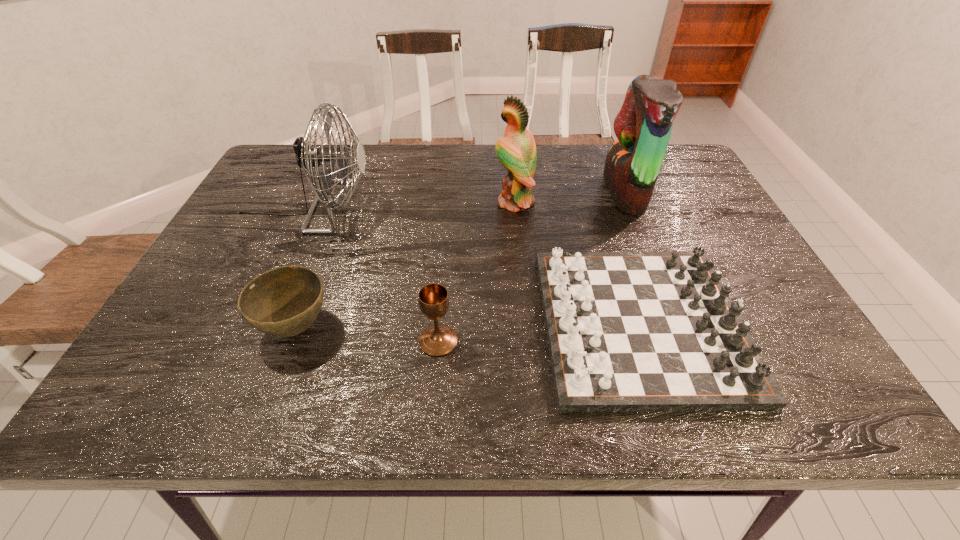
You are a GUI agent. You are given a task and a screenshot of the screen. Output one action in this format:
    pyautogui.click(x=<x>, y=<y>)
    Task: Click on the vacant area situated 0.200m on the front-facing side of the left parrot
    This screenshot has height=540, width=960.
    Given the screenshot: What is the action you would take?
    pyautogui.click(x=420, y=202)

This screenshot has height=540, width=960. Identify the location of free space located 0.290m on the front-facing side of the left parrot. (388, 202).

The image size is (960, 540). I want to click on vacant space located 0.080m on the front-facing side of the left parrot, so click(x=465, y=202).

Locate an element on the screen. The image size is (960, 540). blank space located 0.340m on the front-facing side of the fan is located at coordinates (497, 206).

I want to click on free point located on the front of the chalice, so click(x=433, y=400).

This screenshot has height=540, width=960. What are the coordinates of `free region located 0.140m on the right of the bowl` in the screenshot? It's located at (402, 327).

The image size is (960, 540). Identify the location of free location located on the left of the chessboard. (442, 323).

At what (x,y) coordinates should I click in order to perform the action: click on parrot present at the far edge. Please return your answer as a coordinate pair (x, y). The width and height of the screenshot is (960, 540). Looking at the image, I should click on (643, 126).

You are a GUI agent. You are given a task and a screenshot of the screen. Output one action in this format:
    pyautogui.click(x=<x>, y=<y>)
    Task: Click on the fan located in the far edge section of the desktop
    
    Given the screenshot: What is the action you would take?
    pyautogui.click(x=307, y=158)

I want to click on object at the near edge, so click(627, 331).